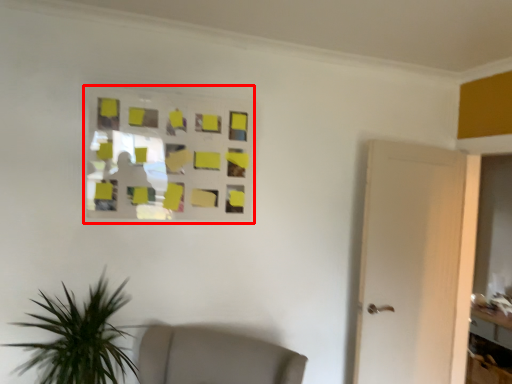
Question: From the image's perspective, what is the correct spatial positioning of glass window (annotated by the red box) in reference to table?

Choices:
 (A) above
 (B) below

Answer: (A)